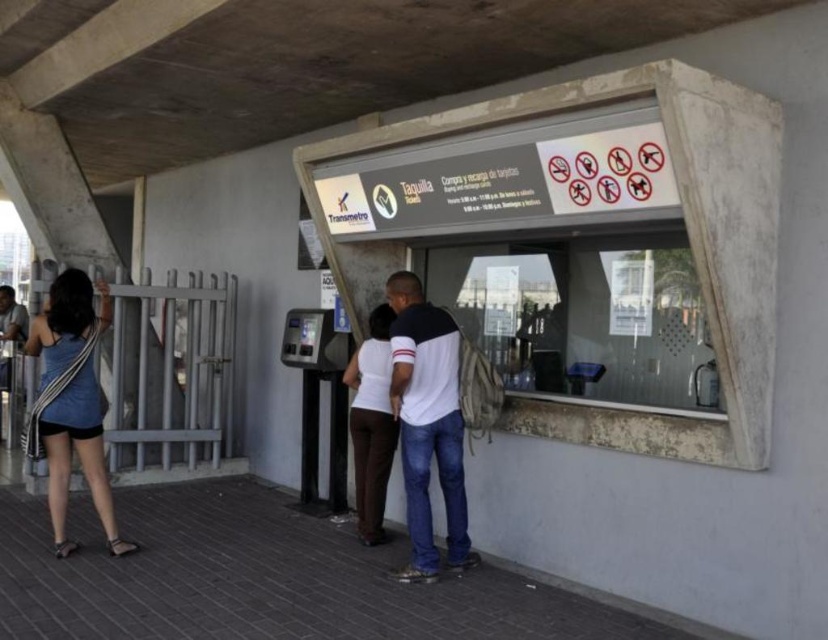
Does white cotton shirt at center have a larger size compared to denim shorts at lower left?

Incorrect, white cotton shirt at center is not larger than denim shorts at lower left.

Who is more forward, (x=437, y=337) or (x=63, y=298)?

Point (x=437, y=337) is in front.

At what (x,y) coordinates should I click in order to perform the action: click on white cotton shirt at center. Please return your answer as a coordinate pair (x, y). Looking at the image, I should click on (427, 422).

Is white cotton shirt at center smaller than white matte pants at center?

Actually, white cotton shirt at center might be larger than white matte pants at center.

Consider the image. Who is lower down, white cotton shirt at center or white matte pants at center?

white matte pants at center is lower down.

The height and width of the screenshot is (640, 828). I want to click on white cotton shirt at center, so click(427, 422).

Is denim shorts at lower left positioned in front of white matte pants at center?

Yes.

Is point (58, 340) closer to camera compared to point (383, 506)?

Yes, it is in front of point (383, 506).

Does point (49, 490) lie behind point (383, 477)?

No, it is not.

Where is `denim shorts at lower left`? The width and height of the screenshot is (828, 640). denim shorts at lower left is located at coordinates (71, 401).